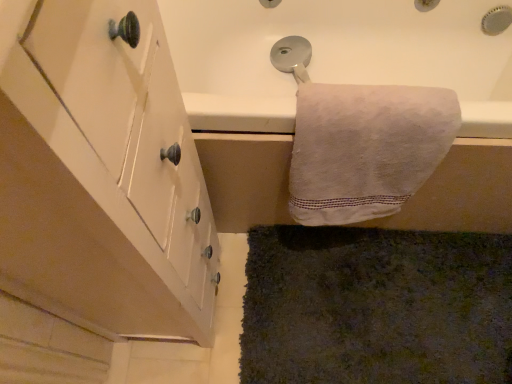
Question: Should I look upward or downward to see white matte cabinet at left?

Choices:
 (A) down
 (B) up

Answer: (A)

Question: Can you confirm if dark green shaggy carpet at lower right is bigger than white matte cabinet at left?

Choices:
 (A) yes
 (B) no

Answer: (B)

Question: Can you confirm if dark green shaggy carpet at lower right is thinner than white matte cabinet at left?

Choices:
 (A) no
 (B) yes

Answer: (A)

Question: From a real-world perspective, is dark green shaggy carpet at lower right on top of white matte cabinet at left?

Choices:
 (A) yes
 (B) no

Answer: (B)

Question: Is dark green shaggy carpet at lower right further to the viewer compared to white matte cabinet at left?

Choices:
 (A) yes
 (B) no

Answer: (A)

Question: Can you confirm if dark green shaggy carpet at lower right is shorter than white matte cabinet at left?

Choices:
 (A) yes
 (B) no

Answer: (A)

Question: Can you see dark green shaggy carpet at lower right touching white matte cabinet at left?

Choices:
 (A) no
 (B) yes

Answer: (A)

Question: Is white matte cabinet at left surrounding white cotton towel at upper right?

Choices:
 (A) yes
 (B) no

Answer: (B)

Question: Is white matte cabinet at left wider than white cotton towel at upper right?

Choices:
 (A) no
 (B) yes

Answer: (B)

Question: Considering the relative positions of white matte cabinet at left and white cotton towel at upper right in the image provided, is white matte cabinet at left in front of white cotton towel at upper right?

Choices:
 (A) no
 (B) yes

Answer: (B)

Question: Is white matte cabinet at left outside white cotton towel at upper right?

Choices:
 (A) yes
 (B) no

Answer: (A)

Question: Considering the relative sizes of white matte cabinet at left and white cotton towel at upper right in the image provided, is white matte cabinet at left smaller than white cotton towel at upper right?

Choices:
 (A) no
 (B) yes

Answer: (A)

Question: Is white matte cabinet at left shorter than white cotton towel at upper right?

Choices:
 (A) yes
 (B) no

Answer: (B)

Question: Is dark green shaggy carpet at lower right with white cotton towel at upper right?

Choices:
 (A) no
 (B) yes

Answer: (A)